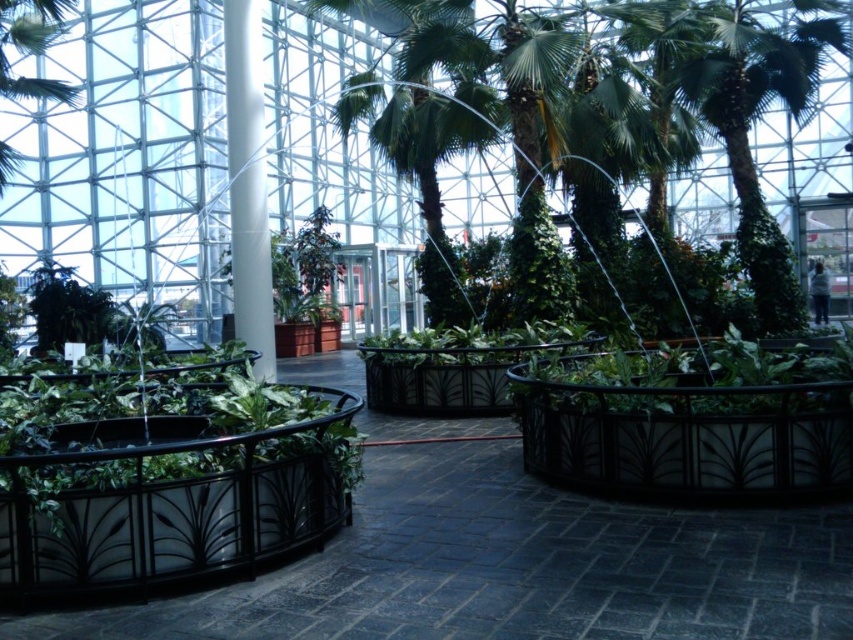
Between green leafy palm tree at center and green leafy palm tree at upper left, which one is positioned higher?

green leafy palm tree at upper left is above.

Where is `green leafy palm tree at center`? green leafy palm tree at center is located at coordinates (756, 116).